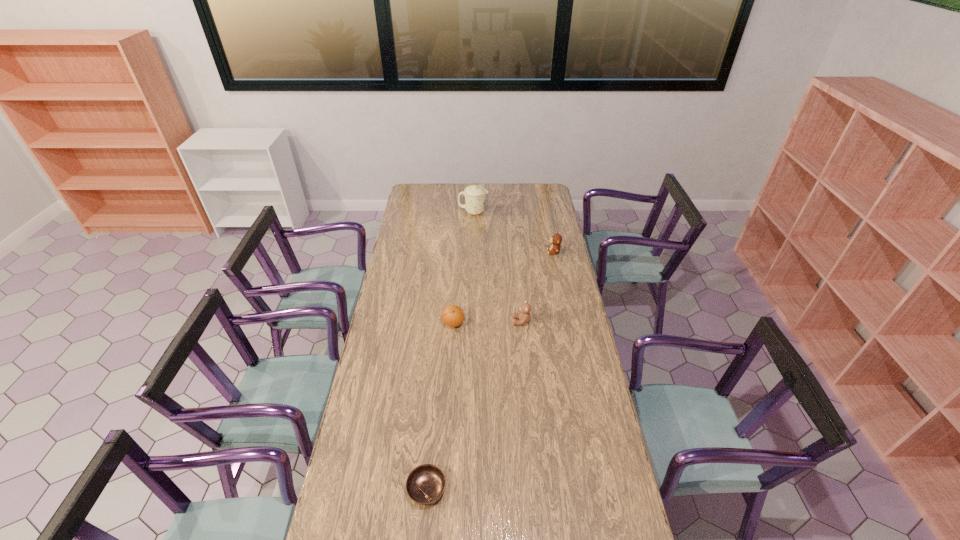
In order to click on free space between the left teddy bear and the nearest object in this screenshot , I will do pyautogui.click(x=474, y=406).

The width and height of the screenshot is (960, 540). What are the coordinates of `empty location between the orange and the nearest object` in the screenshot? It's located at (440, 407).

Identify the location of vacant space in between the orange and the nearest object. (440, 407).

You are a GUI agent. You are given a task and a screenshot of the screen. Output one action in this format:
    pyautogui.click(x=<x>, y=<y>)
    Task: Click on the fourth closest object to the farthest object
    This screenshot has height=540, width=960.
    Given the screenshot: What is the action you would take?
    pyautogui.click(x=425, y=484)

At what (x,y) coordinates should I click in order to perform the action: click on object that is the closest to the soup bowl. Please return your answer as a coordinate pair (x, y). The height and width of the screenshot is (540, 960). Looking at the image, I should click on (452, 315).

Identify the location of vacant space that satisfies the following two spatial constraints: 1. on the face of the rightmost object; 2. on the front side of the soup bowl. Image resolution: width=960 pixels, height=540 pixels. (602, 489).

The width and height of the screenshot is (960, 540). In order to click on vacant region that satisfies the following two spatial constraints: 1. on the face of the right teddy bear; 2. on the front side of the orange in this screenshot , I will do `click(568, 323)`.

Where is `vacant point that satisfies the following two spatial constraints: 1. on the face of the second farthest object; 2. on the front side of the shortest object`? This screenshot has width=960, height=540. vacant point that satisfies the following two spatial constraints: 1. on the face of the second farthest object; 2. on the front side of the shortest object is located at coordinates (602, 489).